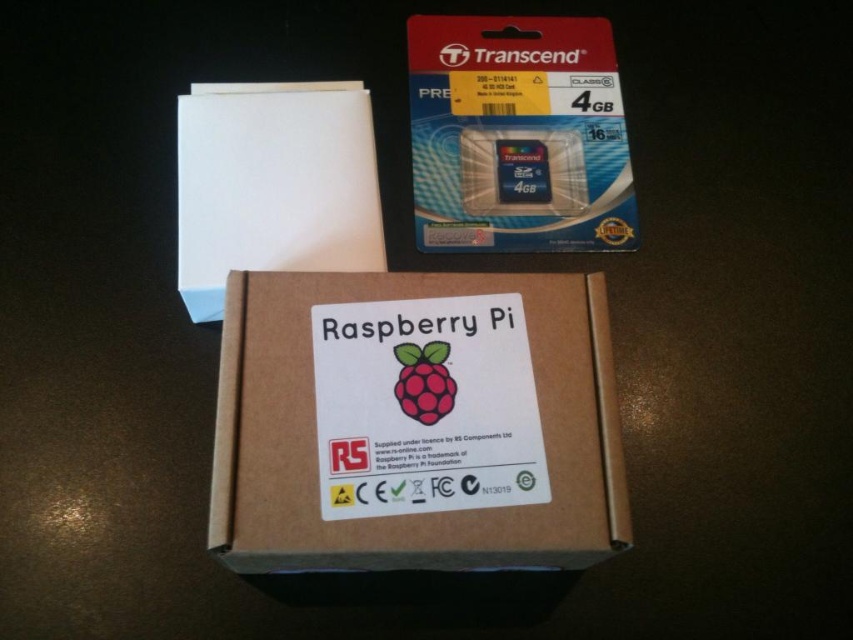
Question: Which point is farther to the camera?

Choices:
 (A) (328, 497)
 (B) (596, 218)
 (C) (358, 216)

Answer: (B)

Question: Is white matte paper at upper left bigger than matte plastic raspberry at center?

Choices:
 (A) no
 (B) yes

Answer: (B)

Question: Is the position of translucent plastic sd card at upper right more distant than that of white matte paper at upper left?

Choices:
 (A) yes
 (B) no

Answer: (A)

Question: Which of the following is the closest to the observer?

Choices:
 (A) (280, 280)
 (B) (554, 112)

Answer: (A)

Question: Which of these objects is positioned closest to the white matte paper at upper left?

Choices:
 (A) brown cardboard box at center
 (B) matte plastic raspberry at center

Answer: (A)

Question: Considering the relative positions of white matte paper at upper left and matte plastic raspberry at center in the image provided, where is white matte paper at upper left located with respect to matte plastic raspberry at center?

Choices:
 (A) above
 (B) below

Answer: (A)